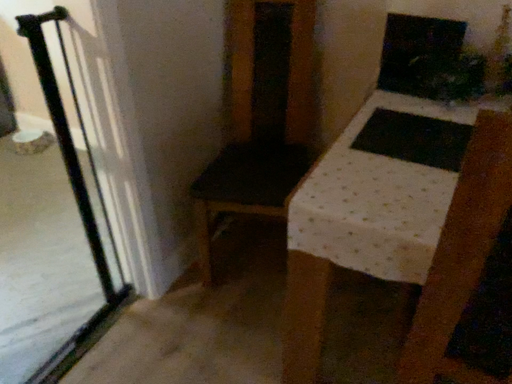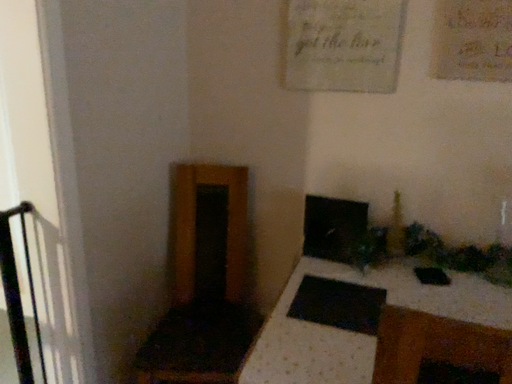
Question: Which way did the camera rotate in the video?

Choices:
 (A) rotated right
 (B) rotated left

Answer: (A)